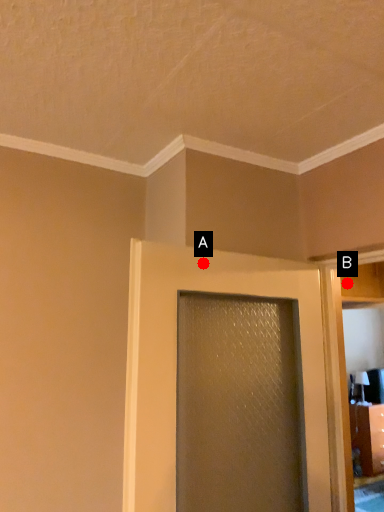
Question: Two points are circled on the image, labeled by A and B beside each circle. Which of the following is the closest to the observer?

Choices:
 (A) A is closer
 (B) B is closer

Answer: (A)